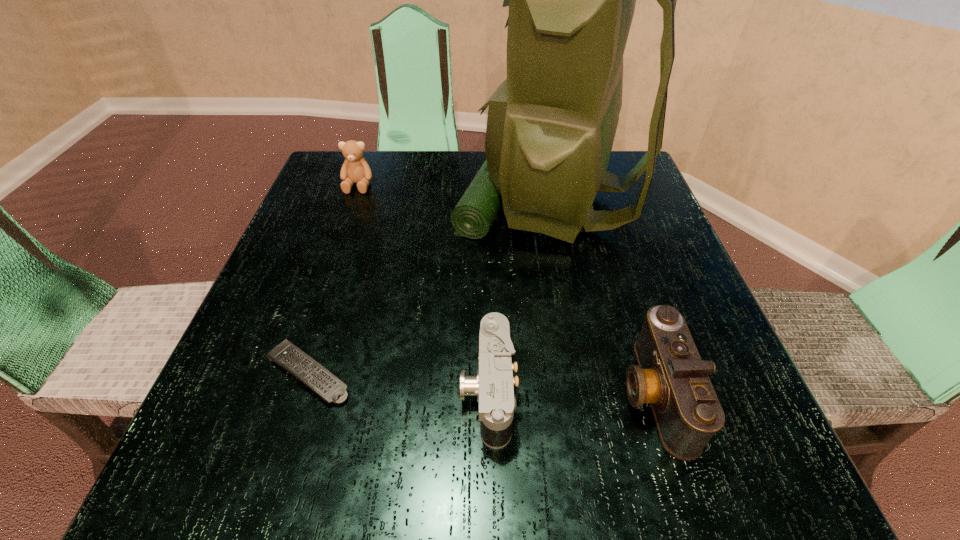
Locate an element on the screen. free location at the far right corner of the desktop is located at coordinates (602, 206).

At what (x,y) coordinates should I click in order to perform the action: click on free spot at the near right corner of the desktop. Please return your answer as a coordinate pair (x, y). Looking at the image, I should click on (763, 457).

The image size is (960, 540). I want to click on vacant area between the teddy bear and the shortest object, so click(x=333, y=279).

Where is `unoccupied area between the shortest object and the fourth tallest object`? unoccupied area between the shortest object and the fourth tallest object is located at coordinates (398, 382).

Identify the location of empty space between the tallest object and the left camera. This screenshot has width=960, height=540. (519, 295).

Where is `vacant point located between the tallest object and the remote control`? vacant point located between the tallest object and the remote control is located at coordinates (429, 286).

At what (x,y) coordinates should I click in order to perform the action: click on free spot between the tallest object and the second shortest object. Please return your answer as a coordinate pair (x, y). Looking at the image, I should click on (519, 295).

Identify the location of free space between the backpack and the taller camera. (602, 296).

Locate an element on the screen. vacant space in between the right camera and the teddy bear is located at coordinates (506, 289).

Identify the location of vacant area between the fourth tallest object and the shortest object. (398, 382).